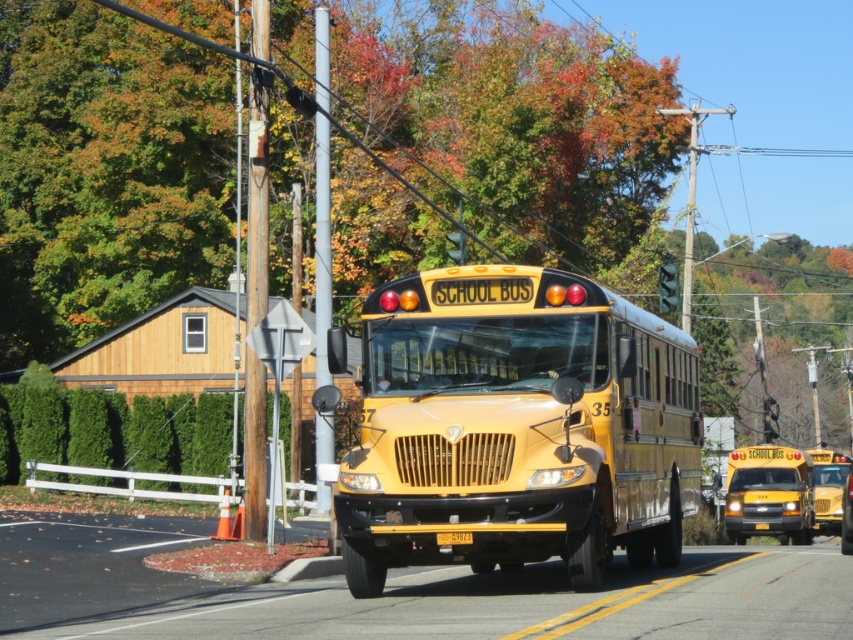
Question: In this image, where is yellow matte/solid school bus at center located relative to matte yellow school bus at center?

Choices:
 (A) above
 (B) below

Answer: (A)

Question: Is yellow matte/solid school bus at center in front of brown wooden pole at left?

Choices:
 (A) no
 (B) yes

Answer: (B)

Question: Among these points, which one is farthest from the camera?

Choices:
 (A) (727, 532)
 (B) (260, 196)
 (C) (434, 483)
 (D) (322, 289)

Answer: (A)

Question: Which object is positioned closest to the brown wooden pole at left?

Choices:
 (A) matte yellow school bus at center
 (B) yellow matte/solid school bus at center
 (C) metallic gray pole at center

Answer: (C)

Question: Is yellow matte/solid school bus at center positioned in front of matte yellow school bus at center?

Choices:
 (A) yes
 (B) no

Answer: (A)

Question: Which object is farther from the camera taking this photo?

Choices:
 (A) matte yellow school bus at center
 (B) metallic gray pole at center
 (C) yellow matte/solid school bus at center
 (D) brown wooden pole at left

Answer: (A)